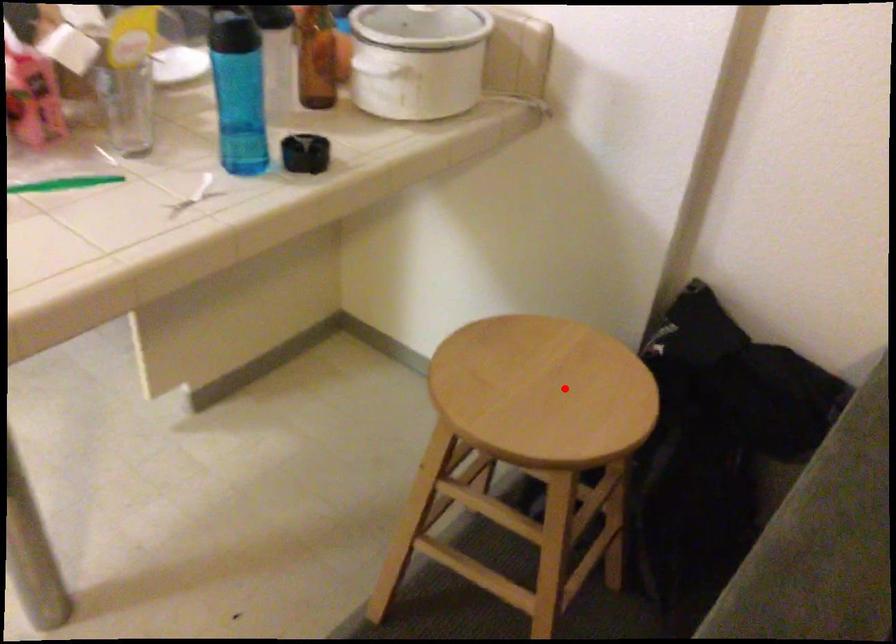
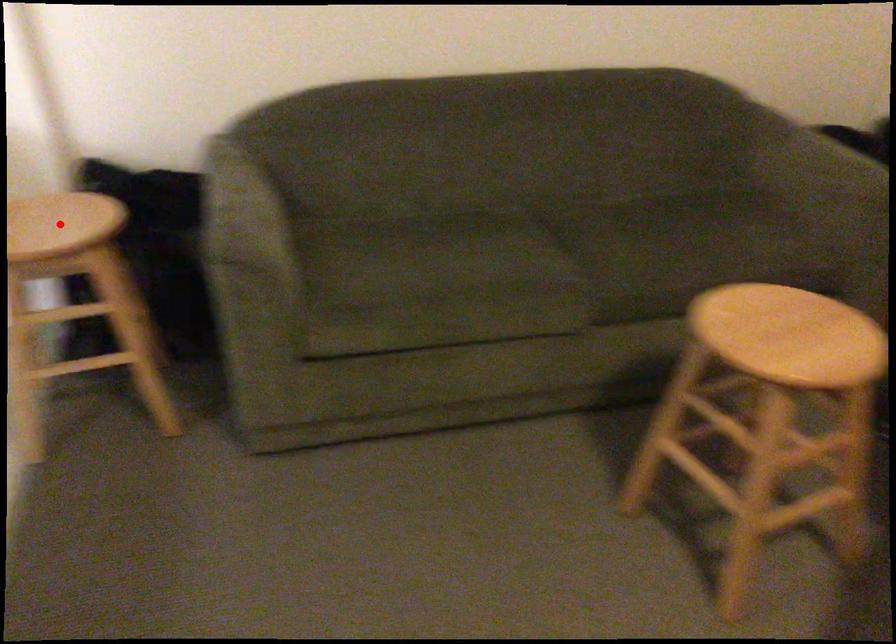
I am providing you with two images of the same scene from different viewpoints. A red point is marked on the first image and another point is marked on the second image. Is the red point in image1 aligned with the point shown in image2?

Yes